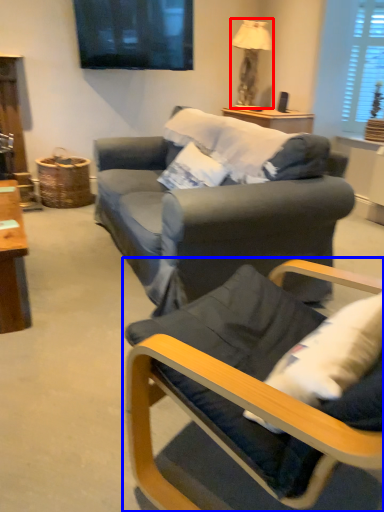
Question: Among these objects, which one is nearest to the camera, lamp (highlighted by a red box) or chair (highlighted by a blue box)?

Choices:
 (A) lamp
 (B) chair

Answer: (B)